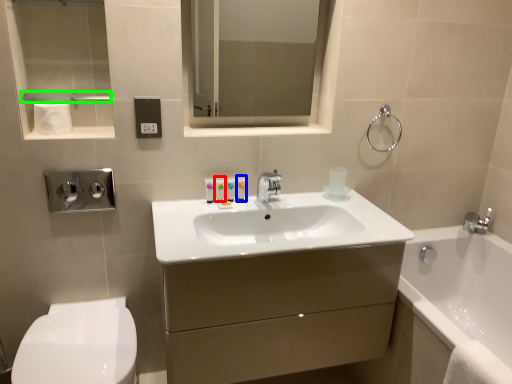
Question: Which object is the farthest from toiletry (highlighted by a red box)? Choose among these: toiletry (highlighted by a blue box) or balustrade (highlighted by a green box).

Choices:
 (A) toiletry
 (B) balustrade

Answer: (B)